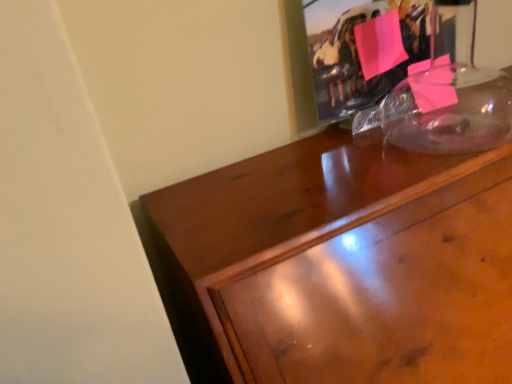
Question: Is glossy wood desk at upper right wider or thinner than pink paper at upper center?

Choices:
 (A) thin
 (B) wide

Answer: (B)

Question: Considering their positions, is glossy wood desk at upper right located in front of or behind pink paper at upper center?

Choices:
 (A) front
 (B) behind

Answer: (A)

Question: Based on their positions, is glossy wood desk at upper right located to the left or right of pink paper at upper center?

Choices:
 (A) left
 (B) right

Answer: (B)

Question: Is point (293, 129) positioned closer to the camera than point (294, 221)?

Choices:
 (A) closer
 (B) farther

Answer: (B)

Question: Considering the positions of pink paper at upper center and glossy wood desk at upper right in the image, is pink paper at upper center taller or shorter than glossy wood desk at upper right?

Choices:
 (A) tall
 (B) short

Answer: (B)

Question: Relative to glossy wood desk at upper right, is pink paper at upper center in front or behind?

Choices:
 (A) front
 (B) behind

Answer: (B)

Question: Considering the positions of pink paper at upper center and glossy wood desk at upper right in the image, is pink paper at upper center bigger or smaller than glossy wood desk at upper right?

Choices:
 (A) small
 (B) big

Answer: (A)